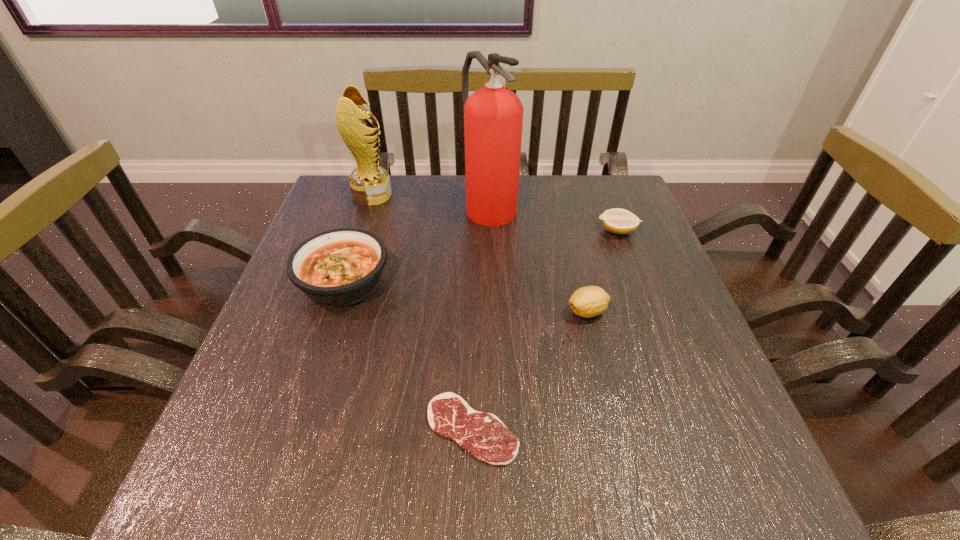
The image size is (960, 540). Find the location of `award at the left edge`. award at the left edge is located at coordinates (370, 185).

Where is `stew that is at the left edge`? The height and width of the screenshot is (540, 960). stew that is at the left edge is located at coordinates (339, 267).

Identify the location of object at the right edge. This screenshot has height=540, width=960. (618, 221).

Image resolution: width=960 pixels, height=540 pixels. I want to click on object present at the far left corner, so point(370,185).

The image size is (960, 540). What are the coordinates of `vacant space at the far edge of the desktop` in the screenshot? It's located at (564, 192).

At what (x,y) coordinates should I click in order to perform the action: click on vacant space at the near edge of the desktop. Please return your answer as a coordinate pair (x, y). This screenshot has height=540, width=960. Looking at the image, I should click on (320, 481).

Image resolution: width=960 pixels, height=540 pixels. I want to click on vacant space at the left edge of the desktop, so tap(269, 339).

You are a GUI agent. You are given a task and a screenshot of the screen. Output one action in this format:
    pyautogui.click(x=<x>, y=<y>)
    Task: Click on the vacant space at the right edge of the desktop
    The height and width of the screenshot is (540, 960).
    Given the screenshot: What is the action you would take?
    pyautogui.click(x=716, y=384)

Find the location of a particular element. The width and height of the screenshot is (960, 540). vacant space at the far right corner of the desktop is located at coordinates (615, 189).

Where is `empty space between the nearest object and the tallest object`? empty space between the nearest object and the tallest object is located at coordinates (481, 316).